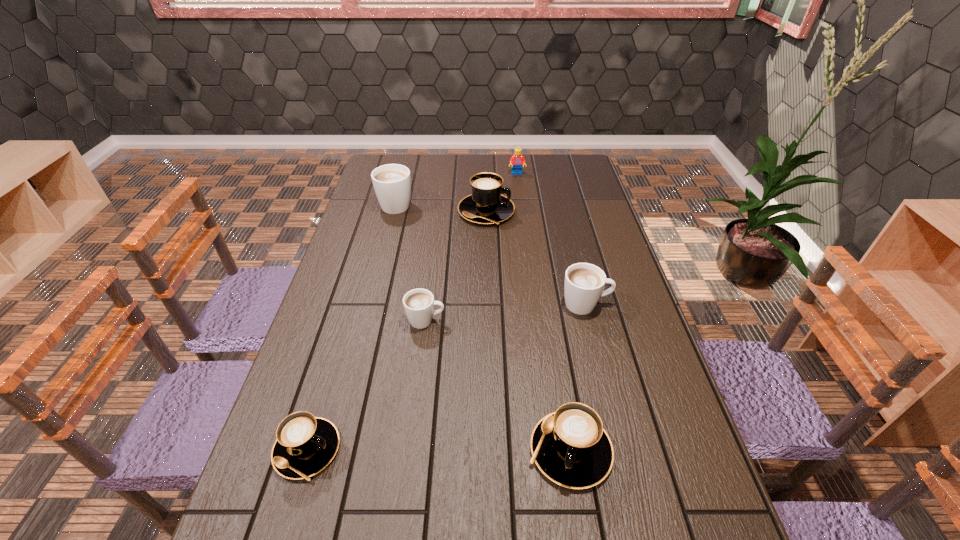
Identify the location of free location at the far edge of the desktop. The image size is (960, 540). pos(433,183).

The height and width of the screenshot is (540, 960). What are the coordinates of `vacant space at the left edge of the desktop` in the screenshot? It's located at (325, 393).

The height and width of the screenshot is (540, 960). What are the coordinates of `free space at the right edge` in the screenshot? It's located at (610, 343).

Where is `vacant space at the far right corner of the desktop`? This screenshot has height=540, width=960. vacant space at the far right corner of the desktop is located at coordinates (580, 154).

Where is `vacant area that lies between the smallest black cappuccino and the rightmost white cappuccino`? This screenshot has height=540, width=960. vacant area that lies between the smallest black cappuccino and the rightmost white cappuccino is located at coordinates (446, 377).

The image size is (960, 540). Identify the location of free space that is in between the second biggest white cappuccino and the farthest black cappuccino. (536, 258).

Locate an element on the screen. free spot between the leftmost black cappuccino and the biggest white cappuccino is located at coordinates (351, 327).

Where is `empty space that is in between the second smallest black cappuccino and the second biggest white cappuccino`? The image size is (960, 540). empty space that is in between the second smallest black cappuccino and the second biggest white cappuccino is located at coordinates (578, 377).

Identify the location of free space between the rightmost white cappuccino and the Lego. Image resolution: width=960 pixels, height=540 pixels. (551, 239).

Find the location of a particular element. The height and width of the screenshot is (540, 960). vacant area between the biggest black cappuccino and the third cappuccino from left to right is located at coordinates (456, 266).